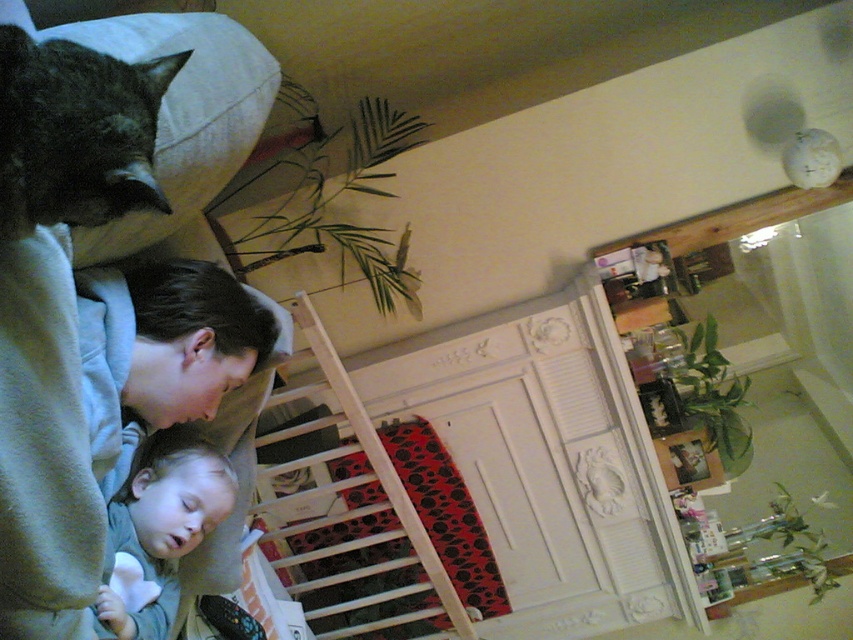
You are a photographer trying to capture a clear photo of the gray fur cat at upper left and the soft gray fabric at lower left. Since the scene is slightly tilted, you need to adjust your camera angle. Which object should you focus on first to ensure both are in frame?

The gray fur cat at upper left is in front of the soft gray fabric at lower left, so you should focus on the gray fur cat at upper left first to ensure both are in frame.

You are a photographer trying to capture a candid shot of the gray fur cat at upper left and the soft gray fabric at lower left. To ensure both subjects are in focus, you need to know their relative positions. Which object is positioned to the right side of the other?

The gray fur cat at upper left is to the right of the soft gray fabric at lower left.

You are a photographer trying to capture a candid shot of the gray fur cat at upper left without disturbing the sleeping person. The camera you are using has a minimum focusing distance of 30 inches. Can you take the photo from your current position?

The gray fur cat at upper left and camera are 34.35 inches apart. Since the minimum focusing distance is 30 inches, the photographer can take the photo from the current position as the distance is sufficient.